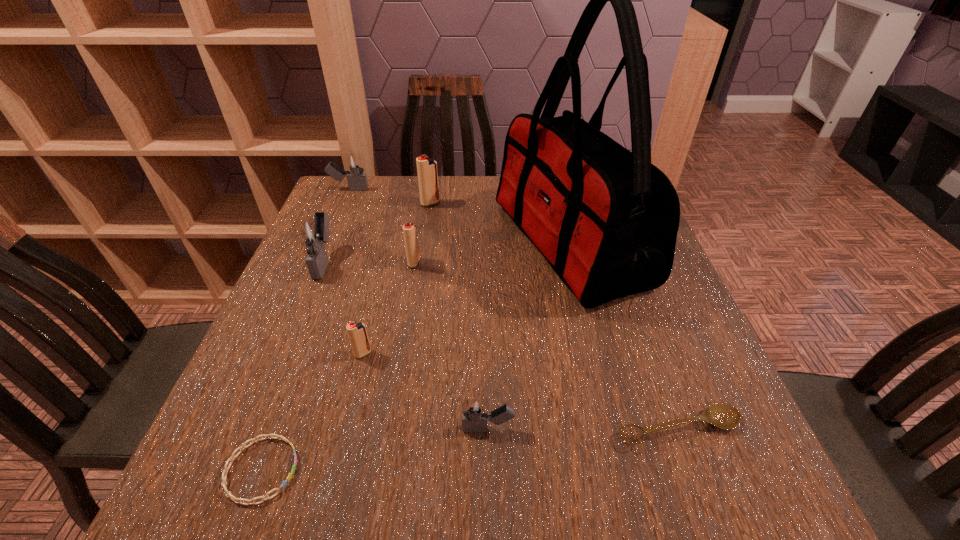
This screenshot has width=960, height=540. What are the coordinates of `igniter that stands as the sixth closest to the ladle` in the screenshot? It's located at (353, 163).

Identify the location of igniter that is the closest to the leftmost red igniter. The height and width of the screenshot is (540, 960). (312, 233).

Select which red igniter is the third closest to the biggest gray igniter. Please provide its 2D coordinates. Your answer should be formatted as a tuple, i.e. [(x, y)], where the tuple contains the x and y coordinates of a point satisfying the conditions above.

[(426, 167)]

The height and width of the screenshot is (540, 960). What are the coordinates of `the second closest red igniter to the biggest red igniter` in the screenshot? It's located at (357, 332).

Find the location of a particular element. gray igniter that stands as the second closest to the nearest igniter is located at coordinates (353, 163).

Image resolution: width=960 pixels, height=540 pixels. In order to click on gray igniter that is the closest to the fifth nearest igniter in this screenshot , I will do pos(353,163).

This screenshot has width=960, height=540. What are the coordinates of `free space that satisfies the following two spatial constraints: 1. on the front side of the eighth tallest object; 2. on the right side of the second farthest gray igniter` in the screenshot? It's located at (x=257, y=428).

Locate an element on the screen. This screenshot has height=540, width=960. free space in the image that satisfies the following two spatial constraints: 1. on the front side of the second farthest igniter; 2. on the left side of the farthest igniter is located at coordinates (344, 204).

Identify the location of free space that satisfies the following two spatial constraints: 1. on the front side of the biggest gray igniter; 2. on the left side of the rightmost igniter. The width and height of the screenshot is (960, 540). (257, 429).

Locate an element on the screen. Image resolution: width=960 pixels, height=540 pixels. free spot that satisfies the following two spatial constraints: 1. on the front side of the eighth tallest object; 2. on the right side of the red duffel bag is located at coordinates (616, 428).